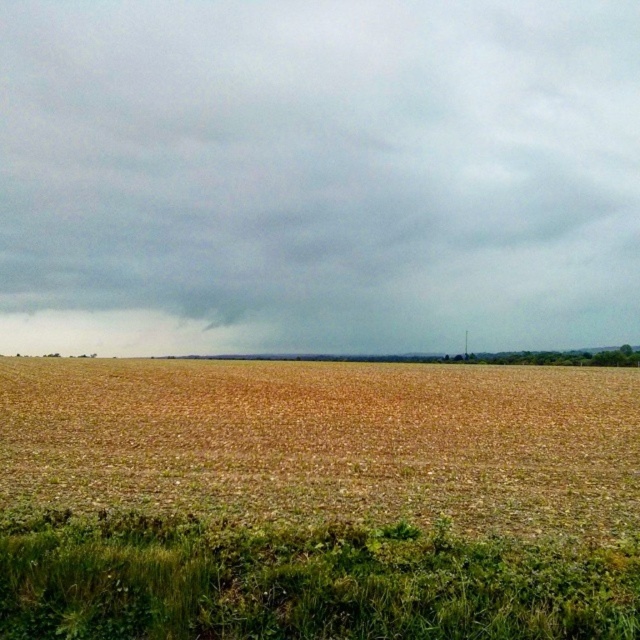
Does gray cloudy sky at upper center have a lesser height compared to brown dry grass at center?

In fact, gray cloudy sky at upper center may be taller than brown dry grass at center.

Find the location of a particular element. This screenshot has width=640, height=640. gray cloudy sky at upper center is located at coordinates (317, 173).